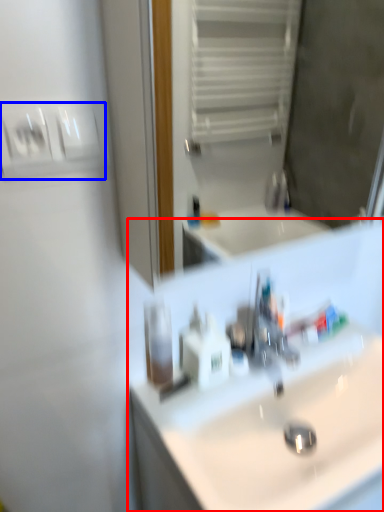
Question: Among these objects, which one is nearest to the camera, sink (highlighted by a red box) or light switch (highlighted by a blue box)?

Choices:
 (A) sink
 (B) light switch

Answer: (B)